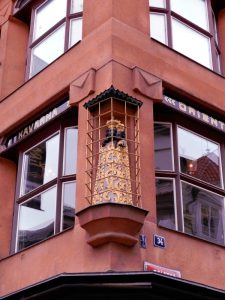
Locate an element on the screen. The width and height of the screenshot is (225, 300). windows is located at coordinates (42, 166), (46, 201), (65, 203), (68, 159), (162, 149), (165, 193), (193, 201), (196, 157).